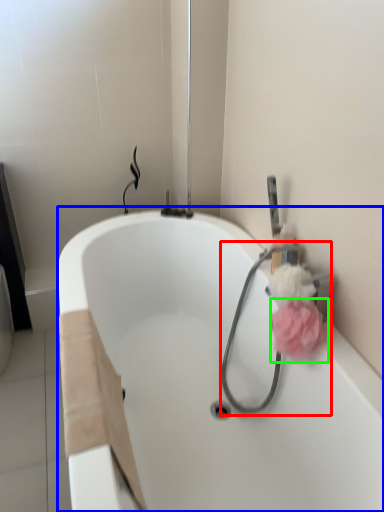
Question: Which object is positioned closest to garden hose (highlighted by a red box)? Select from bathtub (highlighted by a blue box) and flower (highlighted by a green box).

Choices:
 (A) bathtub
 (B) flower

Answer: (B)